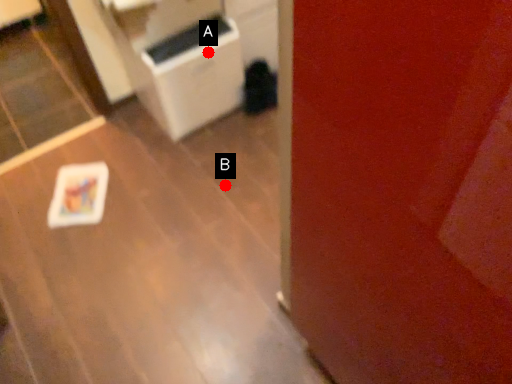
Question: Two points are circled on the image, labeled by A and B beside each circle. Which point appears farthest from the camera in this image?

Choices:
 (A) A is further
 (B) B is further

Answer: (B)